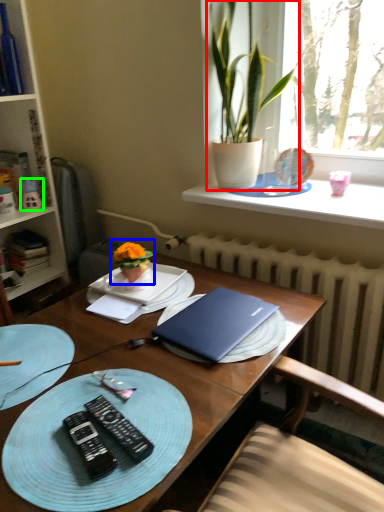
Question: Based on their relative distances, which object is nearer to houseplant (highlighted by a red box)? Choose from houseplant (highlighted by a blue box) and toy (highlighted by a green box).

Choices:
 (A) houseplant
 (B) toy

Answer: (A)